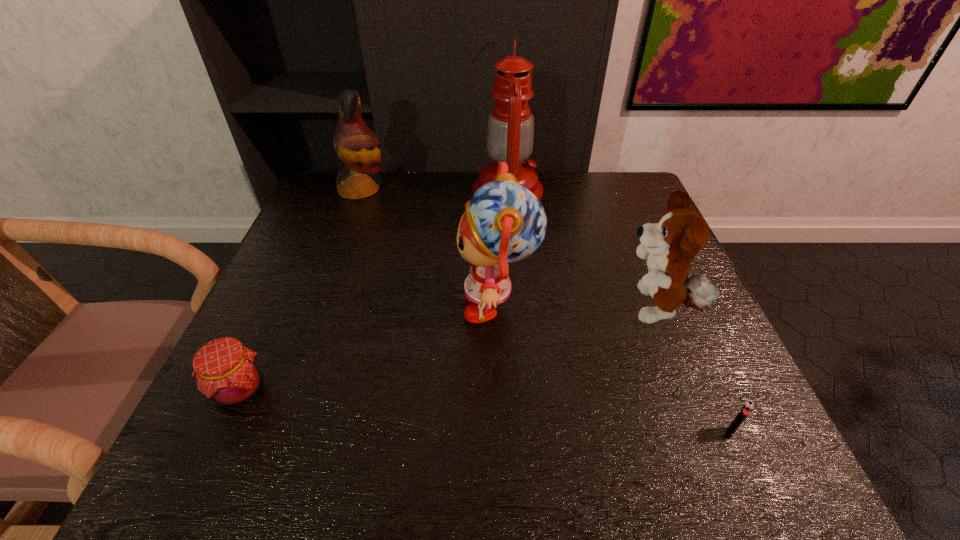
You are a GUI agent. You are given a task and a screenshot of the screen. Output one action in this format:
    pyautogui.click(x=<x>, y=<y>)
    Task: Click on the free space between the igniter and the parrot
    
    Given the screenshot: What is the action you would take?
    pyautogui.click(x=545, y=311)

Locate an element on the screen. The width and height of the screenshot is (960, 540). vacant area between the parrot and the fifth farthest object is located at coordinates [x=301, y=290].

Locate an element on the screen. Image resolution: width=960 pixels, height=540 pixels. object that stands as the closest to the oil lamp is located at coordinates (504, 222).

Choose which object is the third nearest neighbor to the second shortest object. Please provide its 2D coordinates. Your answer should be formatted as a tuple, i.e. [(x, y)], where the tuple contains the x and y coordinates of a point satisfying the conditions above.

[(510, 130)]

You are a GUI agent. You are given a task and a screenshot of the screen. Output one action in this format:
    pyautogui.click(x=<x>, y=<y>)
    Task: Click on the free spot that satisfies the following two spatial constraints: 1. on the back side of the oil lamp; 2. on the face of the parrot
    
    Given the screenshot: What is the action you would take?
    pyautogui.click(x=508, y=190)

The height and width of the screenshot is (540, 960). I want to click on free space that satisfies the following two spatial constraints: 1. on the face of the parrot; 2. on the right side of the igniter, so click(x=275, y=433).

Where is `free space that satisfies the following two spatial constraints: 1. on the face of the puppy; 2. on the left side of the shortest object`? This screenshot has width=960, height=540. free space that satisfies the following two spatial constraints: 1. on the face of the puppy; 2. on the left side of the shortest object is located at coordinates (705, 433).

Where is `free point that satisfies the following two spatial constraints: 1. on the face of the puppy; 2. on the back side of the igniter`? This screenshot has width=960, height=540. free point that satisfies the following two spatial constraints: 1. on the face of the puppy; 2. on the back side of the igniter is located at coordinates (705, 433).

Locate an element on the screen. The width and height of the screenshot is (960, 540). vacant space that satisfies the following two spatial constraints: 1. on the back side of the tallest object; 2. on the face of the parrot is located at coordinates (508, 190).